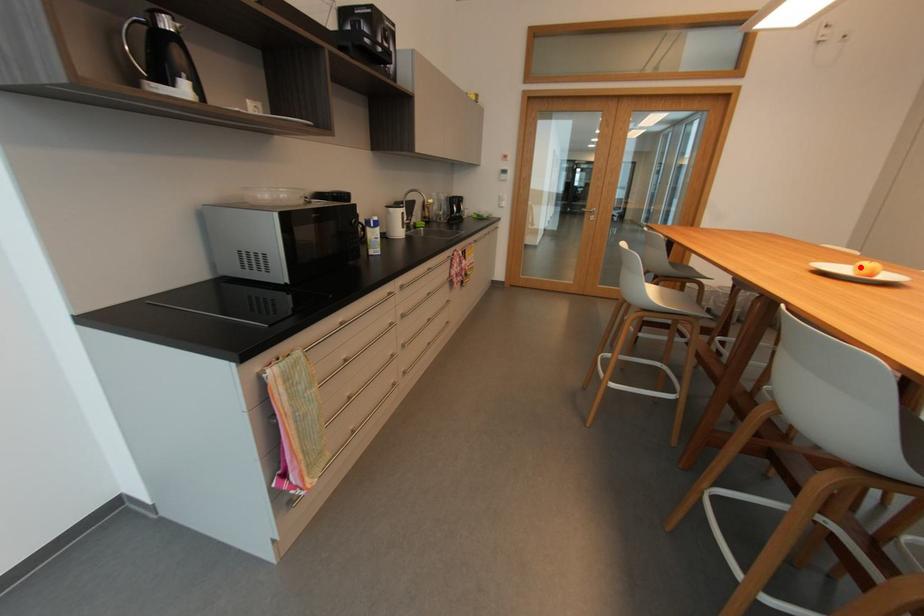
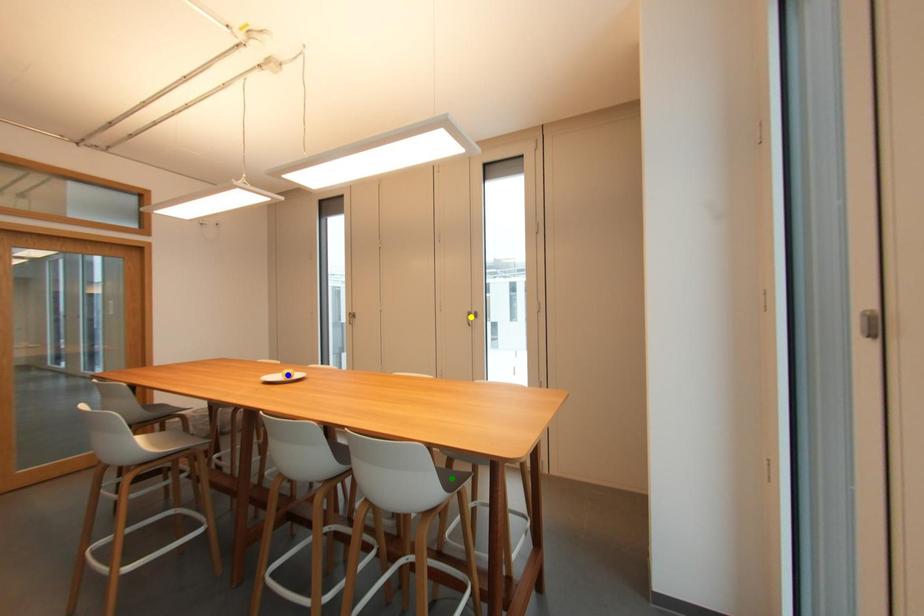
Question: I am providing you with two images of the same scene from different viewpoints. A red point is marked on the first image. You are given multiple points on the second image. Which point in image 2 is actually the same real-world point as the red point in image 1?

Choices:
 (A) blue point
 (B) green point
 (C) yellow point

Answer: (A)